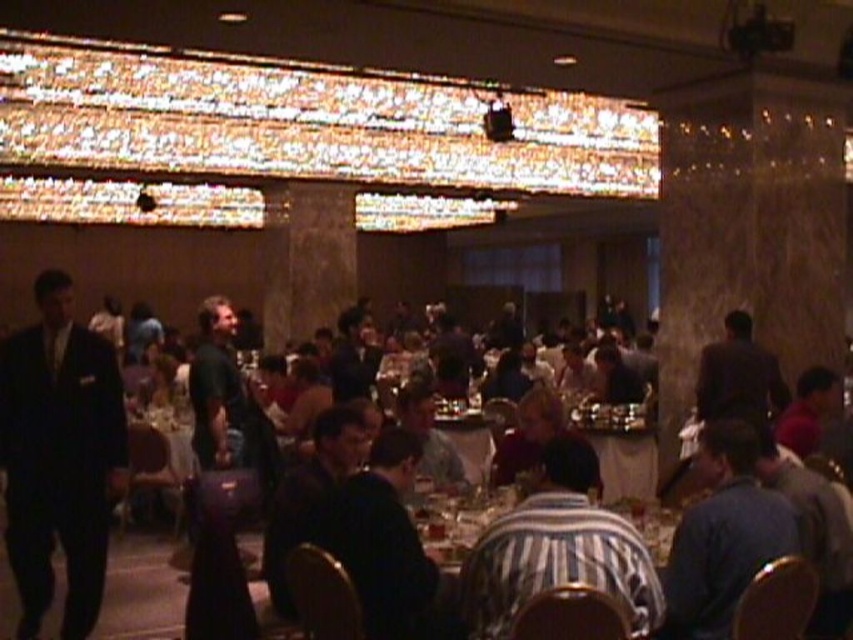
You are standing at the entrance of the hall and want to locate the blue fabric shirt at lower right. According to the coordinates provided, where should you look to find it?

The blue fabric shirt at lower right is located at coordinates point (723, 536), which is towards the lower right portion of the hall.

You are a photographer standing at the entrance of the hall. You want to take a photo that includes both the black suit at left and the striped fabric shirt at center. What is the minimum distance you need to move backward to ensure both are in frame?

The black suit at left and striped fabric shirt at center are 2.59 meters apart from each other. To capture both in the same frame, you need to move backward until the camera can encompass a distance of at least 2.59 meters between them. The exact distance depends on the camera lens and sensor size, but moving back several meters should work.